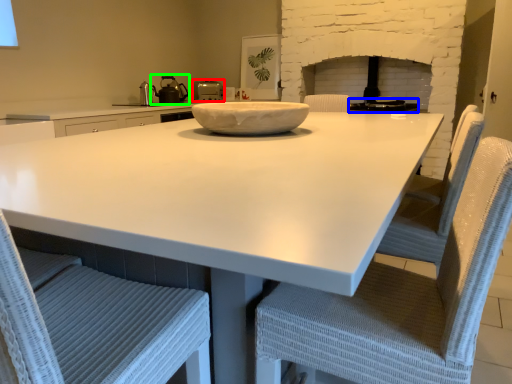
Question: Which is nearer to the kitchen appliance (highlighted by a red box)? appliance (highlighted by a blue box) or tea pot (highlighted by a green box).

Choices:
 (A) appliance
 (B) tea pot

Answer: (B)